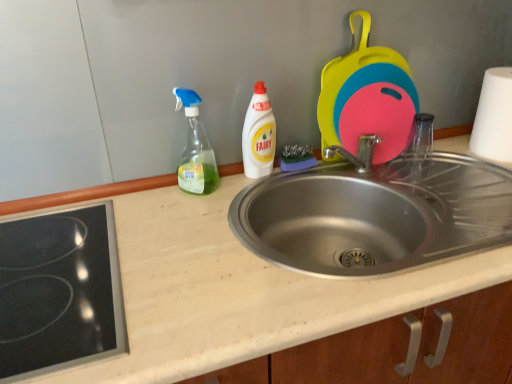
You are a GUI agent. You are given a task and a screenshot of the screen. Output one action in this format:
    pyautogui.click(x=<x>, y=<y>)
    Task: Click on the vacant space to the right of transparent plastic spray bottle at center, the 1th bottle in the left-to-right sequence
    This screenshot has width=512, height=384.
    Given the screenshot: What is the action you would take?
    pyautogui.click(x=244, y=186)